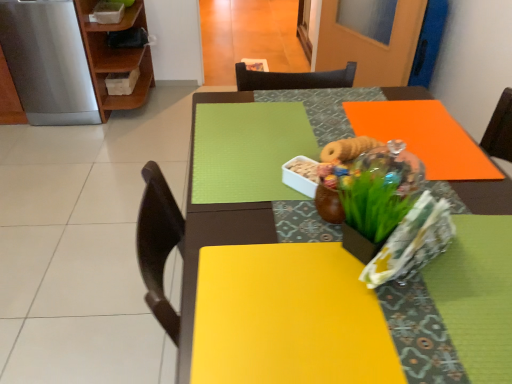
Question: Is green matte floral arrangement at center to the left or to the right of stainless steel refrigerator at left in the image?

Choices:
 (A) right
 (B) left

Answer: (A)

Question: From the image's perspective, is green matte floral arrangement at center above or below stainless steel refrigerator at left?

Choices:
 (A) below
 (B) above

Answer: (A)

Question: Considering the real-world distances, which object is closest to the wooden shelf at upper left?

Choices:
 (A) stainless steel refrigerator at left
 (B) orange matte table at upper right
 (C) green matte floral arrangement at center

Answer: (A)

Question: Considering the real-world distances, which object is closest to the orange matte table at upper right?

Choices:
 (A) stainless steel refrigerator at left
 (B) wooden shelf at upper left
 (C) green matte floral arrangement at center

Answer: (C)